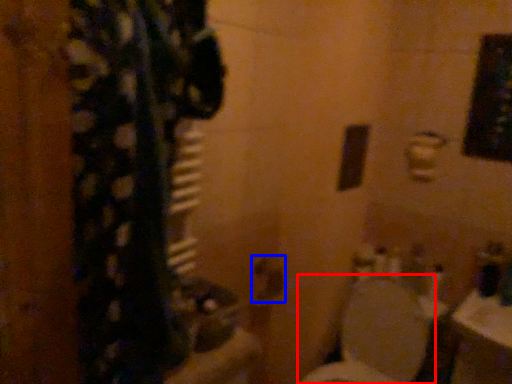
Question: Which object is further to the camera taking this photo, toilet (highlighted by a red box) or door handle (highlighted by a blue box)?

Choices:
 (A) toilet
 (B) door handle

Answer: (B)